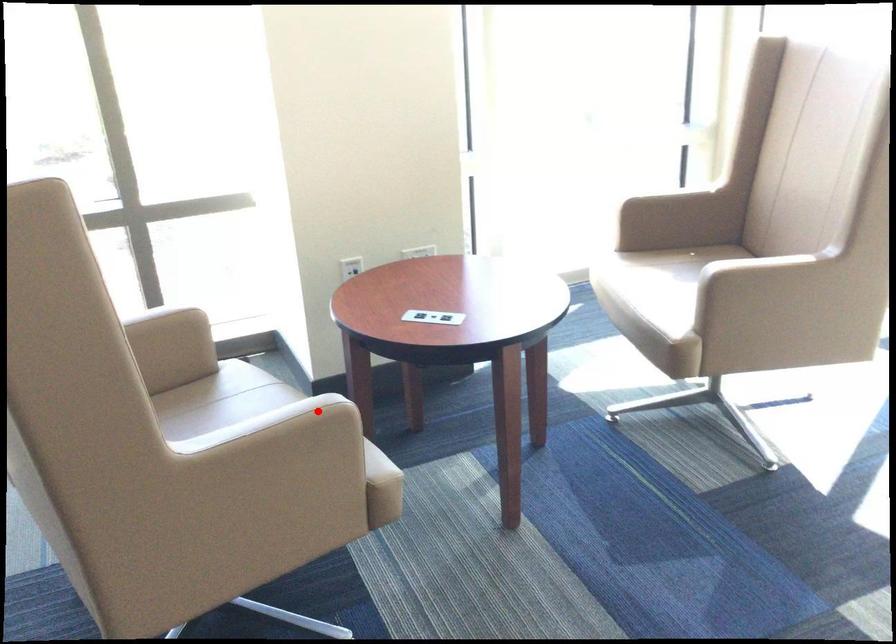
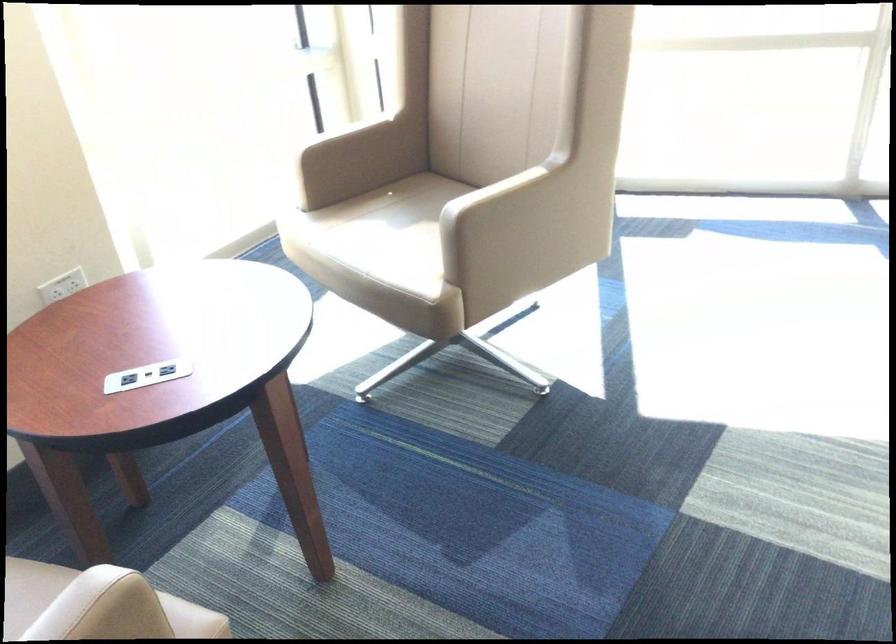
The point at the highlighted location is marked in the first image. Where is the corresponding point in the second image?

(97, 605)